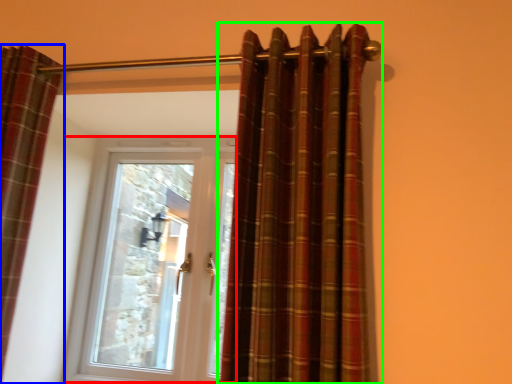
Question: Which is nearer to the door (highlighted by a red box)? curtain (highlighted by a blue box) or curtain (highlighted by a green box).

Choices:
 (A) curtain
 (B) curtain

Answer: (A)